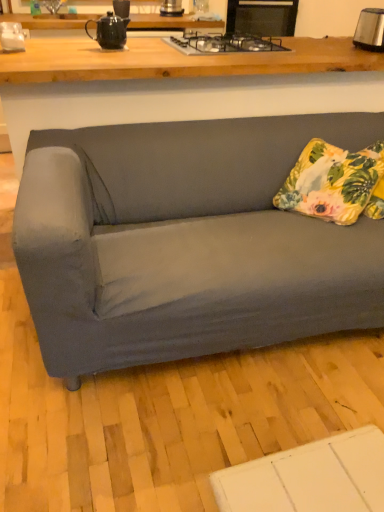
Question: From the image's perspective, relative to metallic silver toaster at upper center, the 1th appliance from the back, is satin silver toaster at upper right above or below?

Choices:
 (A) below
 (B) above

Answer: (A)

Question: Is satin silver toaster at upper right bigger or smaller than metallic silver toaster at upper center, positioned as the first appliance in right-to-left order?

Choices:
 (A) small
 (B) big

Answer: (B)

Question: Which object is the farthest from the matte wood desk at upper center?

Choices:
 (A) white glossy coffee maker at upper left, the 1th appliance when ordered from bottom to top
 (B) satin silver toaster at upper right
 (C) matte black teapot at upper center
 (D) metallic silver toaster at upper center, which appears as the 2th appliance when ordered from the bottom
 (E) black glass gas stove at upper center

Answer: (D)

Question: Considering the real-world distances, which object is farthest from the white glossy coffee maker at upper left, which ranks as the first appliance in front-to-back order?

Choices:
 (A) matte wood desk at upper center
 (B) matte black teapot at upper center
 (C) metallic silver toaster at upper center, which appears as the 2th appliance when ordered from the bottom
 (D) floral fabric pillow at right
 (E) satin silver toaster at upper right

Answer: (E)